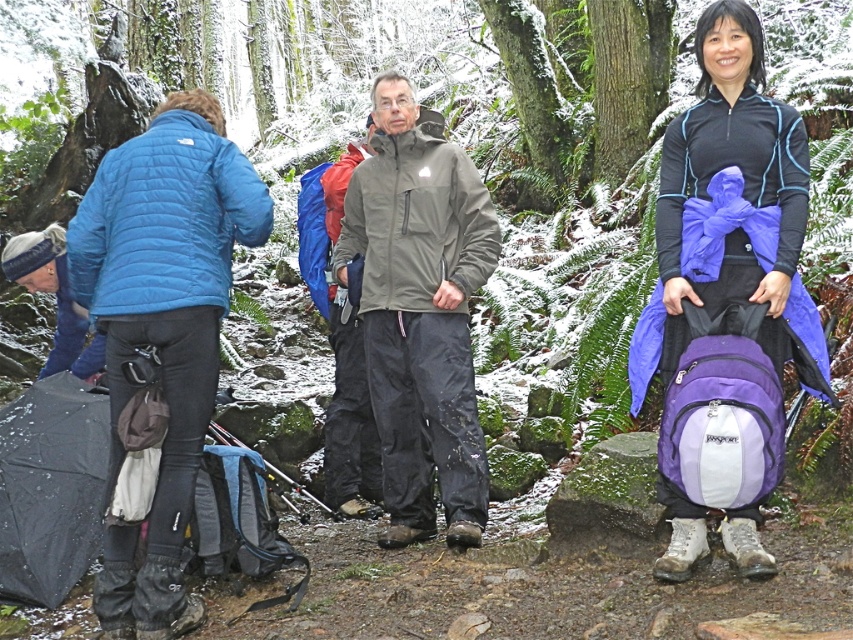
You are planning to take a photo of the matte blue jacket at left and the matte purple backpack at center. To ensure both are in the frame, should you adjust your camera to include more space to the left or right of the current view?

The matte purple backpack at center is positioned on the right side of the matte blue jacket at left, so to include both in the frame, you should adjust your camera to include more space to the right of the current view.

You are planning to place a new object, a red tent, between the matte purple backpack at center and the matte blue jacket at left. Considering the spatial relationship between the two objects, which side of the backpack should the tent be placed on to ensure it is closer to the jacket?

The red tent should be placed on the side of the matte purple backpack at center that faces the matte blue jacket at left to ensure it is closer to the jacket.